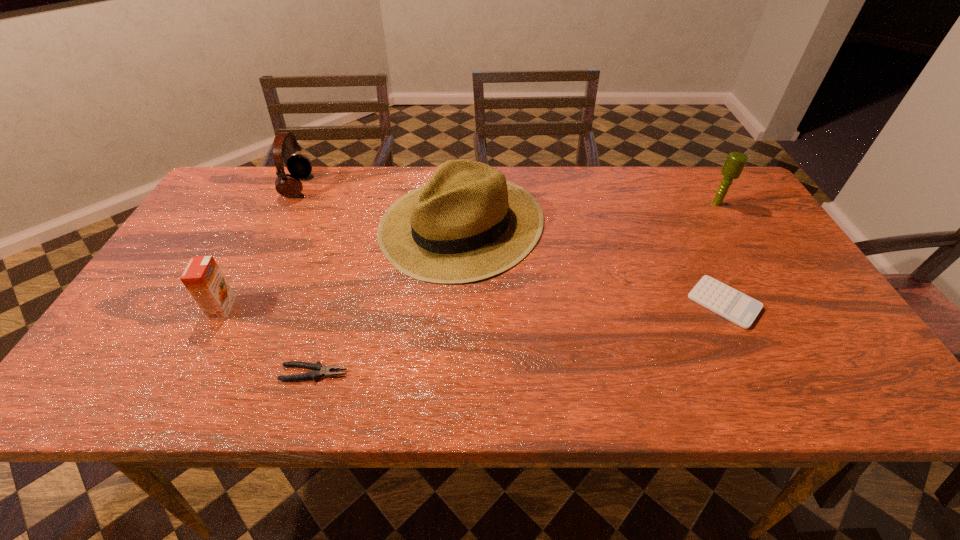
The height and width of the screenshot is (540, 960). I want to click on free space that satisfies the following two spatial constraints: 1. on the ear pads of the headset; 2. on the front side of the orange juice, so (x=237, y=308).